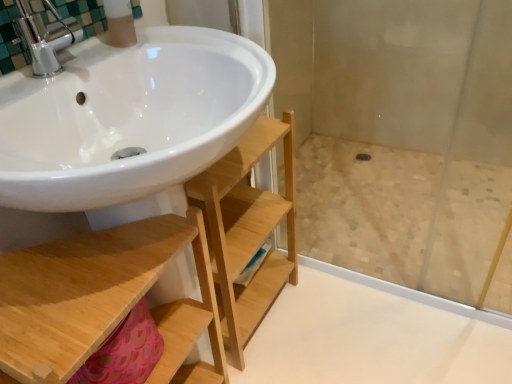
This screenshot has width=512, height=384. I want to click on empty space that is to the right of matte plastic soap dispenser at upper left, so click(192, 47).